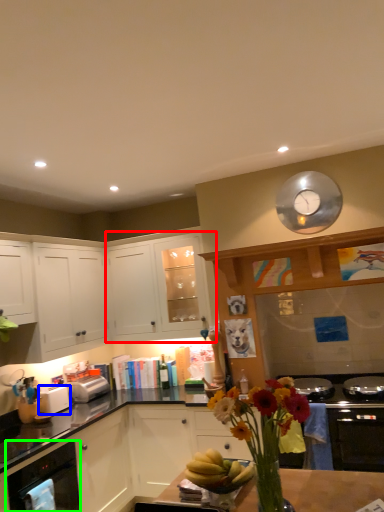
Question: Based on their relative distances, which object is nearer to cabinetry (highlighted by a red box)? Choose from toaster (highlighted by a blue box) and kitchen appliance (highlighted by a green box).

Choices:
 (A) toaster
 (B) kitchen appliance

Answer: (A)